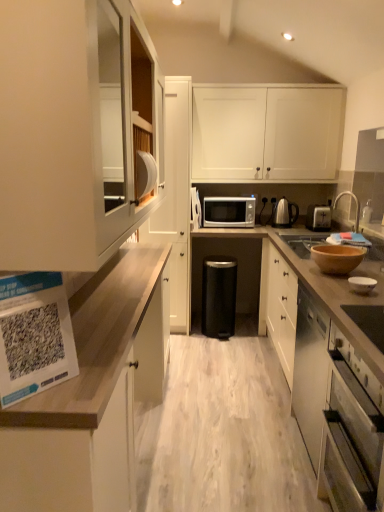
The image size is (384, 512). I want to click on blank space to the left of wooden at right, so click(221, 361).